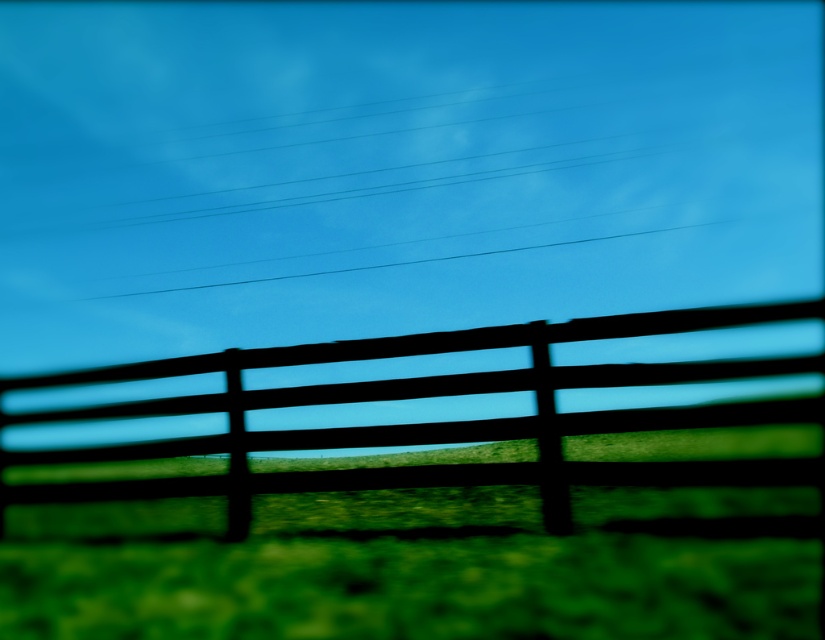
Question: Can you confirm if green matte grass at center is positioned below black wood fence at center?

Choices:
 (A) yes
 (B) no

Answer: (A)

Question: Does green matte grass at center have a greater width compared to black wood fence at center?

Choices:
 (A) no
 (B) yes

Answer: (A)

Question: Is green matte grass at center thinner than black wood fence at center?

Choices:
 (A) no
 (B) yes

Answer: (B)

Question: Which object is closer to the camera taking this photo?

Choices:
 (A) green matte grass at center
 (B) black wood fence at center

Answer: (A)

Question: Which point is farther from the camera taking this photo?

Choices:
 (A) (280, 556)
 (B) (569, 472)

Answer: (B)